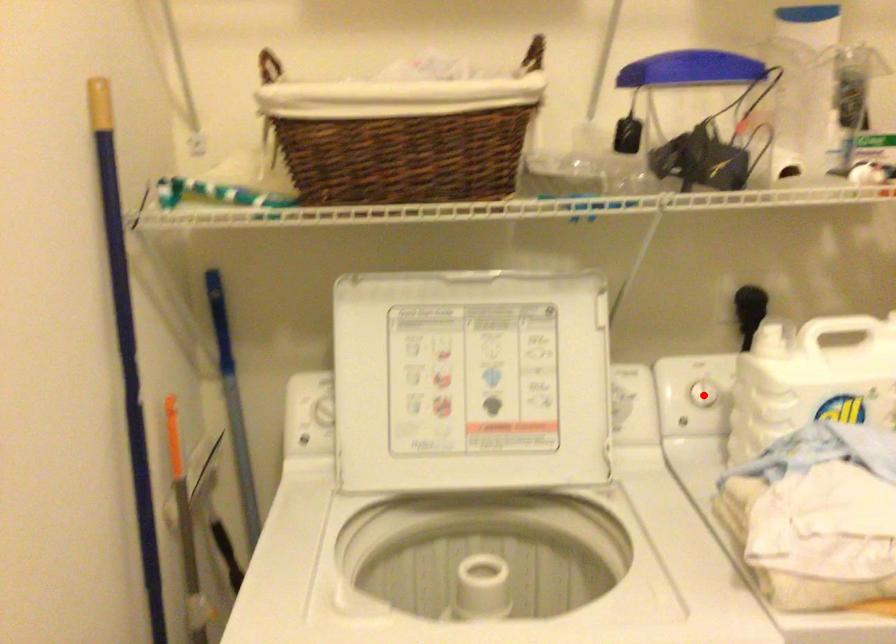
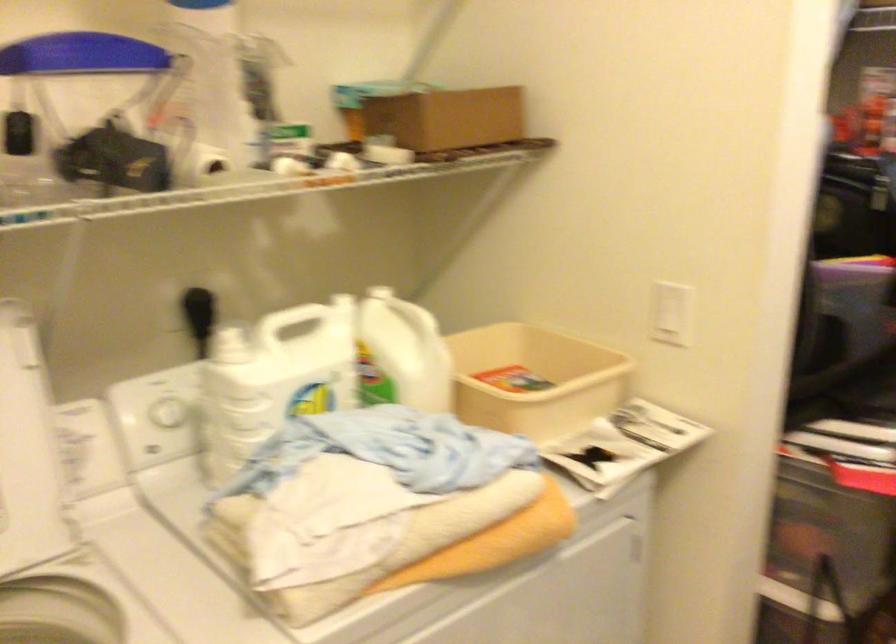
Where in the second image is the point corresponding to the highlighted location from the first image?

(168, 412)